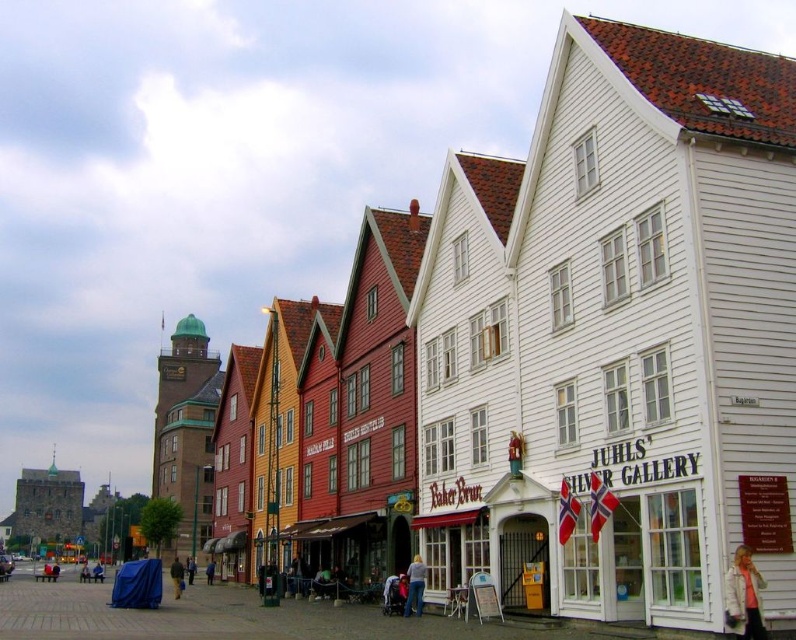
Question: Which is farther from the white fabric jacket at lower right?

Choices:
 (A) light blue jeans at center
 (B) blue fabric at center
 (C) yellow fabric bag at lower left

Answer: (B)

Question: From the image, what is the correct spatial relationship of yellow fabric bag at lower left in relation to blue fabric at center?

Choices:
 (A) above
 (B) below

Answer: (A)

Question: Considering the relative positions of white fabric jacket at lower right and light blue jeans at center in the image provided, where is white fabric jacket at lower right located with respect to light blue jeans at center?

Choices:
 (A) left
 (B) right

Answer: (B)

Question: Does light blue jeans at center have a smaller size compared to blue fabric at center?

Choices:
 (A) no
 (B) yes

Answer: (B)

Question: Among these points, which one is nearest to the camera?

Choices:
 (A) (207, 570)
 (B) (750, 572)
 (C) (180, 563)
 (D) (416, 612)

Answer: (B)

Question: Which point is farther from the camera taking this photo?

Choices:
 (A) (412, 605)
 (B) (176, 564)
 (C) (732, 556)

Answer: (B)